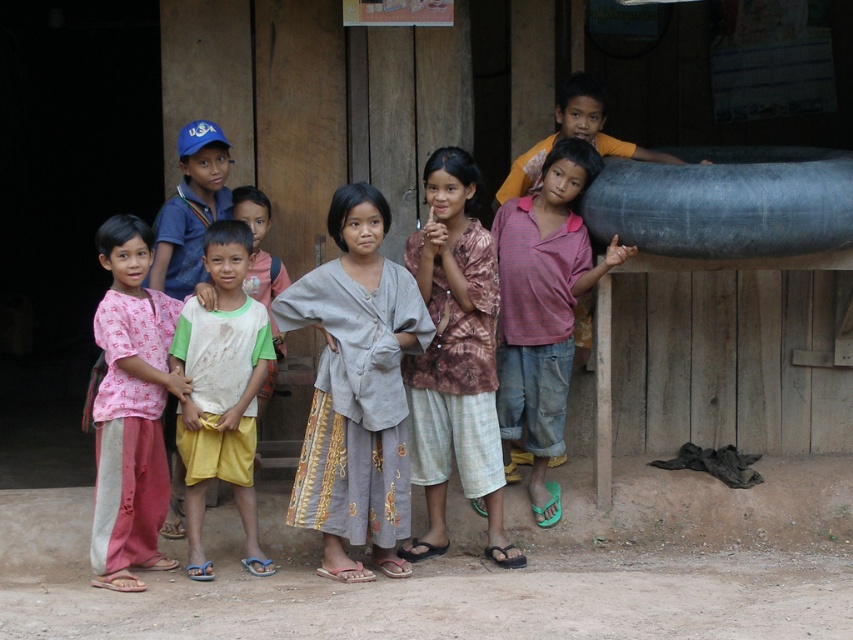
Is printed fabric shirt at center wider than pink striped shirt at center?

In fact, printed fabric shirt at center might be narrower than pink striped shirt at center.

Which is above, printed fabric shirt at center or pink striped shirt at center?

Positioned higher is pink striped shirt at center.

Is point (410, 461) farther from camera compared to point (549, 240)?

No, (410, 461) is closer to viewer.

Locate an element on the screen. printed fabric shirt at center is located at coordinates (454, 356).

Which is behind, point (550, 225) or point (216, 440)?

The point (550, 225) is behind.

Looking at this image, can you confirm if pink striped shirt at center is positioned above white t-shirt at center?

Indeed, pink striped shirt at center is positioned over white t-shirt at center.

Does point (535, 260) come farther from viewer compared to point (236, 241)?

Yes.

Find the location of `pink striped shirt at center`. pink striped shirt at center is located at coordinates (543, 307).

Describe the element at coordinates (357, 388) in the screenshot. I see `gray fabric shirt at center` at that location.

Does gray fabric shirt at center lie in front of white cotton shirt at center?

Yes.

Is point (392, 300) farther from camera compared to point (257, 289)?

No, (392, 300) is closer to viewer.

At what (x,y) coordinates should I click in order to perform the action: click on gray fabric shirt at center. Please return your answer as a coordinate pair (x, y). This screenshot has width=853, height=640. Looking at the image, I should click on (357, 388).